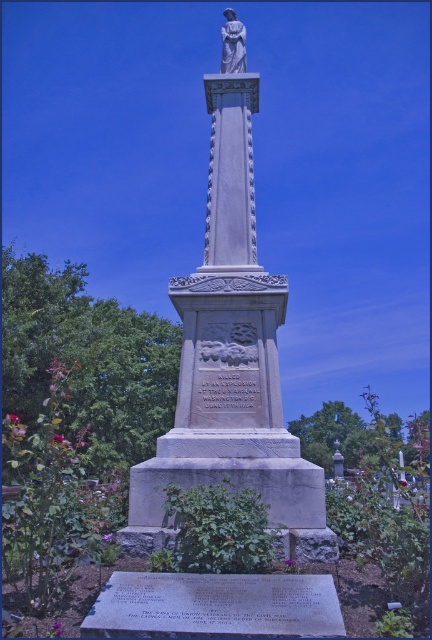
Question: Is gray stone monument at center further to the viewer compared to white marble statue at upper center?

Choices:
 (A) no
 (B) yes

Answer: (A)

Question: Which of the following is the farthest from the observer?

Choices:
 (A) gray stone monument at center
 (B) white marble statue at upper center

Answer: (B)

Question: Which point is farther to the camera?

Choices:
 (A) gray stone monument at center
 (B) white marble statue at upper center

Answer: (B)

Question: Is gray stone monument at center bigger than white marble statue at upper center?

Choices:
 (A) no
 (B) yes

Answer: (A)

Question: Is gray stone monument at center to the left of white marble statue at upper center from the viewer's perspective?

Choices:
 (A) yes
 (B) no

Answer: (B)